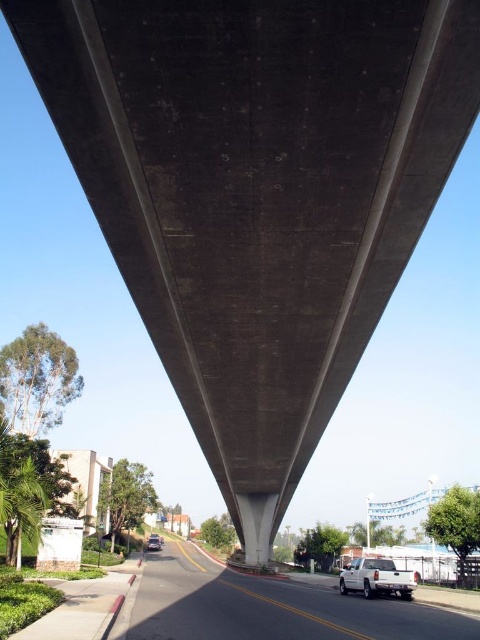
You are a pedestrian standing on the sidewalk next to the road. You see the white glossy truck at lower center and the metallic silver car at lower center. Which vehicle is closer to you?

The white glossy truck at lower center and metallic silver car at lower center are 34.72 meters apart from each other, so it depends on their exact positions along the road. However, since both are at lower center, they are equidistant from your position on the sidewalk.

You are standing at the bottom left corner of the image, looking up at the bridge. There are two points marked on the road below the bridge. Which point is closer to you, point (x=352, y=624) or point (x=354, y=577)?

Point (x=352, y=624) is closer to you because it is in front of point (x=354, y=577).